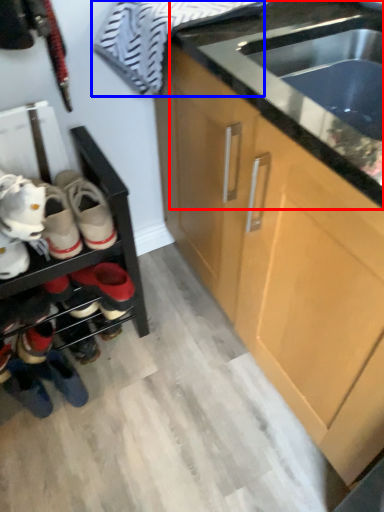
Question: Which point is closer to the camera, countertop (highlighted by a red box) or laundry (highlighted by a blue box)?

Choices:
 (A) countertop
 (B) laundry

Answer: (A)